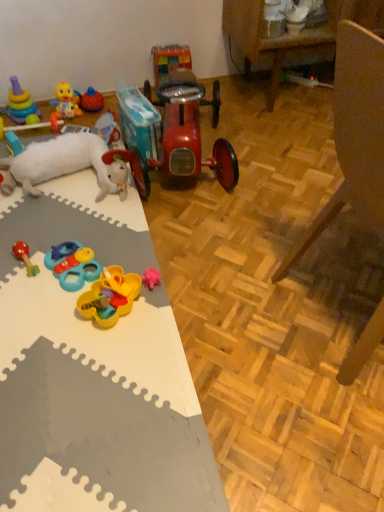
Where is `free location to the right of multicolored plastic toy at center, acting as the tenth toy starting from the left`? The width and height of the screenshot is (384, 512). free location to the right of multicolored plastic toy at center, acting as the tenth toy starting from the left is located at coordinates (219, 96).